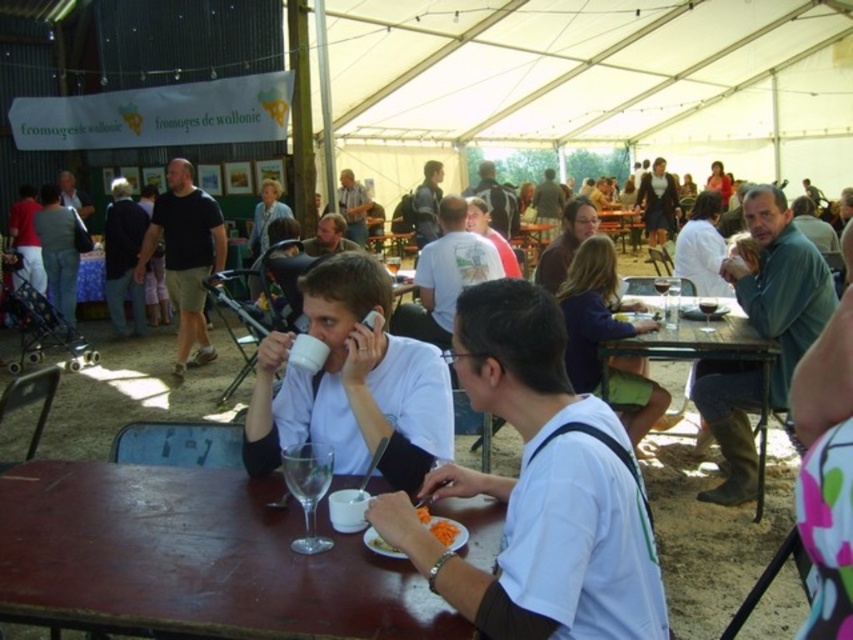
You are at the food festival and want to grab a drink from the table. There is a point marked at coordinates [306,477]. What object is located at that point?

The point at coordinates [306,477] indicates the clear glass wine at table center.

You are a photographer at the event and need to place a small tripod between the dark gray backpack at center and the matte gray shirt at center. Since the tripod requires a flat surface, will the space between them be sufficient?

The dark gray backpack at center is shorter than the matte gray shirt at center, so the space between them may vary depending on their positions. However, the description does not provide specific measurements for the distance between them. Without knowing the exact distance, it is uncertain if the space is sufficient for the tripod.